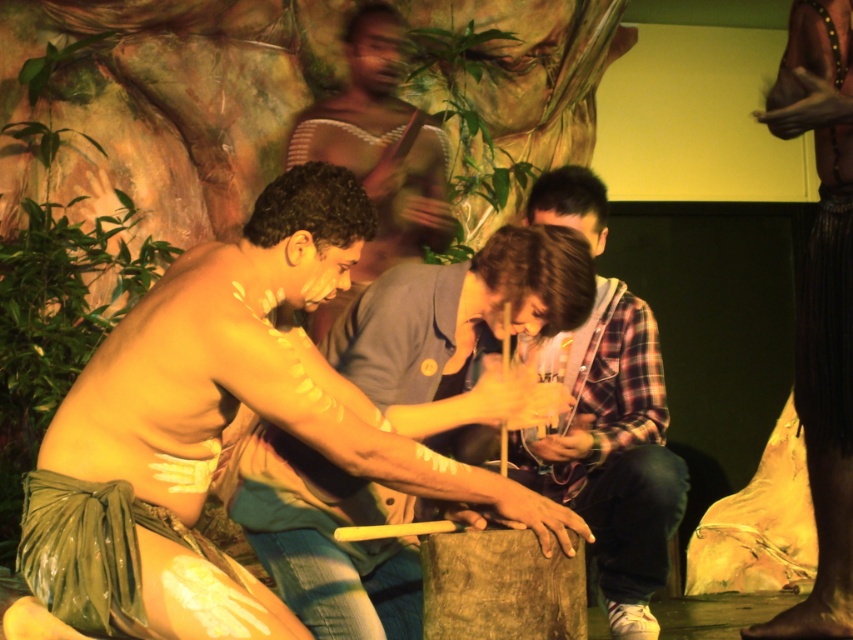
Is point (637, 534) positioned in front of point (824, 241)?

Yes, point (637, 534) is in front of point (824, 241).

Is point (634, 496) positioned after point (839, 164)?

No, (634, 496) is in front of (839, 164).

This screenshot has height=640, width=853. I want to click on plaid shirt at center, so click(611, 451).

Who is more forward, (97, 442) or (437, 180)?

Point (97, 442) is more forward.

Does green textured cloth at center appear over smooth skin man at center?

No, green textured cloth at center is not above smooth skin man at center.

The image size is (853, 640). I want to click on green textured cloth at center, so click(x=218, y=432).

What do you see at coordinates (611, 451) in the screenshot?
I see `plaid shirt at center` at bounding box center [611, 451].

Find the location of a particular element. This screenshot has width=853, height=640. plaid shirt at center is located at coordinates (611, 451).

Is point (608, 554) farther from viewer compared to point (347, 97)?

No, it is not.

Find the location of `plaid shirt at center`. plaid shirt at center is located at coordinates (611, 451).